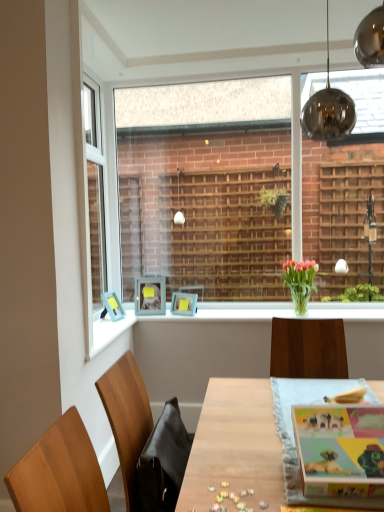
Question: Does translucent glass vase at center have a larger size compared to matte blue picture frame at center, arranged as the 1th picture frame when viewed from the left?

Choices:
 (A) no
 (B) yes

Answer: (B)

Question: Can we say translucent glass vase at center lies outside matte blue picture frame at center, arranged as the 1th picture frame when viewed from the left?

Choices:
 (A) yes
 (B) no

Answer: (A)

Question: Is translucent glass vase at center turned away from matte blue picture frame at center, arranged as the 1th picture frame when viewed from the left?

Choices:
 (A) no
 (B) yes

Answer: (A)

Question: Is translucent glass vase at center taller than matte blue picture frame at center, arranged as the 1th picture frame when viewed from the left?

Choices:
 (A) yes
 (B) no

Answer: (A)

Question: Does translucent glass vase at center appear on the right side of matte blue picture frame at center, arranged as the 1th picture frame when viewed from the left?

Choices:
 (A) yes
 (B) no

Answer: (A)

Question: Would you say translucent glass vase at center is a long distance from matte blue picture frame at center, acting as the 3th picture frame starting from the right?

Choices:
 (A) no
 (B) yes

Answer: (B)

Question: Does matte blue picture frame at center, acting as the 3th picture frame starting from the right, have a lesser width compared to white glossy window sill at center?

Choices:
 (A) no
 (B) yes

Answer: (B)

Question: Is matte blue picture frame at center, acting as the 3th picture frame starting from the right, looking in the opposite direction of white glossy window sill at center?

Choices:
 (A) yes
 (B) no

Answer: (B)

Question: Can you confirm if matte blue picture frame at center, arranged as the 1th picture frame when viewed from the left, is positioned to the left of white glossy window sill at center?

Choices:
 (A) no
 (B) yes

Answer: (B)

Question: From a real-world perspective, is matte blue picture frame at center, acting as the 3th picture frame starting from the right, positioned over white glossy window sill at center based on gravity?

Choices:
 (A) no
 (B) yes

Answer: (B)

Question: Does matte blue picture frame at center, arranged as the 1th picture frame when viewed from the left, have a lesser height compared to white glossy window sill at center?

Choices:
 (A) no
 (B) yes

Answer: (A)

Question: From the image's perspective, is matte blue picture frame at center, arranged as the 1th picture frame when viewed from the left, on white glossy window sill at center?

Choices:
 (A) yes
 (B) no

Answer: (A)

Question: Does wooden table at center appear on the left side of matte blue picture frame at center, acting as the 3th picture frame starting from the right?

Choices:
 (A) no
 (B) yes

Answer: (A)